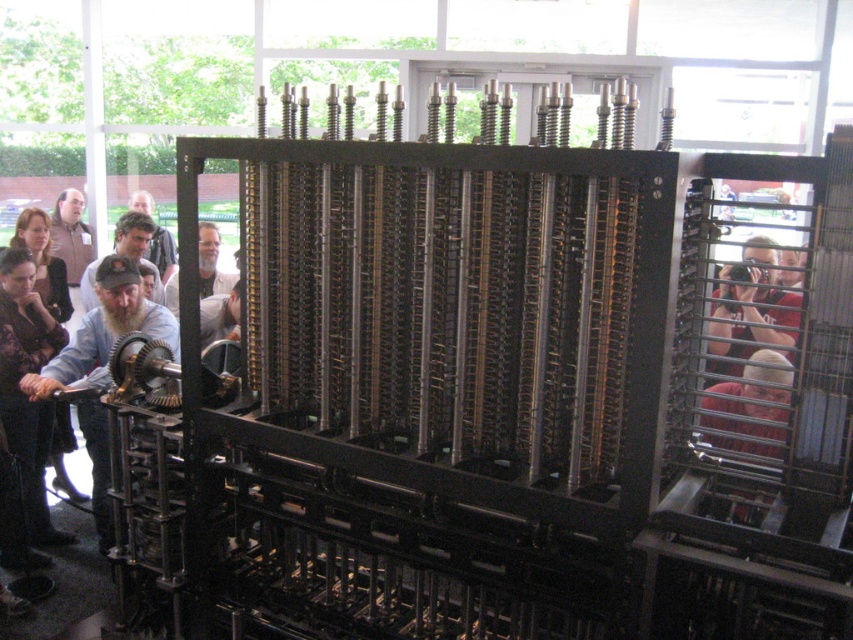
You are a technician working on the historical computing machine. You need to reach the red shirt at right and the light brown hair at center. Which one is closer to you?

The red shirt at right and light brown hair at center are 3.18 meters apart, so without knowing your exact position, it is impossible to determine which is closer.

You are standing in front of a large mechanical device. There is a point marked at coordinates (744, 408) on the device. What object is located at this point?

The point at coordinates (744, 408) marks the location of the red shirt at right.